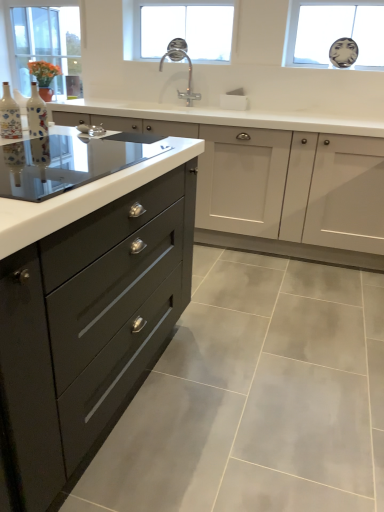
Question: Can you confirm if clear glass window at upper left, which appears as the first window when viewed from the left, is shorter than matte ceramic vase at left, which appears as the 1th bottle when viewed from the left?

Choices:
 (A) yes
 (B) no

Answer: (B)

Question: Is clear glass window at upper left, the 3th window in the right-to-left sequence, taller than matte ceramic vase at left, positioned as the 2th bottle in right-to-left order?

Choices:
 (A) no
 (B) yes

Answer: (B)

Question: Considering the relative sizes of clear glass window at upper left, which appears as the first window when viewed from the left, and matte ceramic vase at left, positioned as the 2th bottle in right-to-left order, in the image provided, is clear glass window at upper left, which appears as the first window when viewed from the left, wider than matte ceramic vase at left, positioned as the 2th bottle in right-to-left order,?

Choices:
 (A) no
 (B) yes

Answer: (B)

Question: Is clear glass window at upper left, the 3th window in the right-to-left sequence, oriented towards matte ceramic vase at left, positioned as the 2th bottle in right-to-left order?

Choices:
 (A) no
 (B) yes

Answer: (A)

Question: Is clear glass window at upper left, the 3th window in the right-to-left sequence, positioned beyond the bounds of matte ceramic vase at left, which appears as the 1th bottle when viewed from the left?

Choices:
 (A) no
 (B) yes

Answer: (B)

Question: Looking at the image, does matte black drawer at left seem bigger or smaller compared to matte black drawer at left?

Choices:
 (A) big
 (B) small

Answer: (B)

Question: From a real-world perspective, is matte black drawer at left physically located above or below matte black drawer at left?

Choices:
 (A) above
 (B) below

Answer: (A)

Question: Is point (304, 190) closer or farther from the camera than point (26, 358)?

Choices:
 (A) farther
 (B) closer

Answer: (A)

Question: Considering the relative positions of matte black drawer at left and matte black drawer at left in the image provided, is matte black drawer at left to the left or to the right of matte black drawer at left?

Choices:
 (A) left
 (B) right

Answer: (B)

Question: Considering the positions of decorative ceramic vase at left, which is the second bottle in left-to-right order, and polished chrome faucet at center in the image, is decorative ceramic vase at left, which is the second bottle in left-to-right order, wider or thinner than polished chrome faucet at center?

Choices:
 (A) thin
 (B) wide

Answer: (A)

Question: Looking at the image, does decorative ceramic vase at left, which is the second bottle in left-to-right order, seem bigger or smaller compared to polished chrome faucet at center?

Choices:
 (A) big
 (B) small

Answer: (B)

Question: Would you say decorative ceramic vase at left, which is the second bottle in left-to-right order, is to the left or to the right of polished chrome faucet at center in the picture?

Choices:
 (A) right
 (B) left

Answer: (B)

Question: Is decorative ceramic vase at left, the 1th bottle from the right, taller or shorter than polished chrome faucet at center?

Choices:
 (A) short
 (B) tall

Answer: (A)

Question: From the image's perspective, is decorative ceramic vase at left, the 1th bottle from the right, positioned above or below transparent glass mirror at upper right, acting as the 3th window starting from the left?

Choices:
 (A) below
 (B) above

Answer: (A)

Question: Considering the positions of decorative ceramic vase at left, which is the second bottle in left-to-right order, and transparent glass mirror at upper right, which appears as the 1th window when viewed from the right, in the image, is decorative ceramic vase at left, which is the second bottle in left-to-right order, taller or shorter than transparent glass mirror at upper right, which appears as the 1th window when viewed from the right,?

Choices:
 (A) tall
 (B) short

Answer: (B)